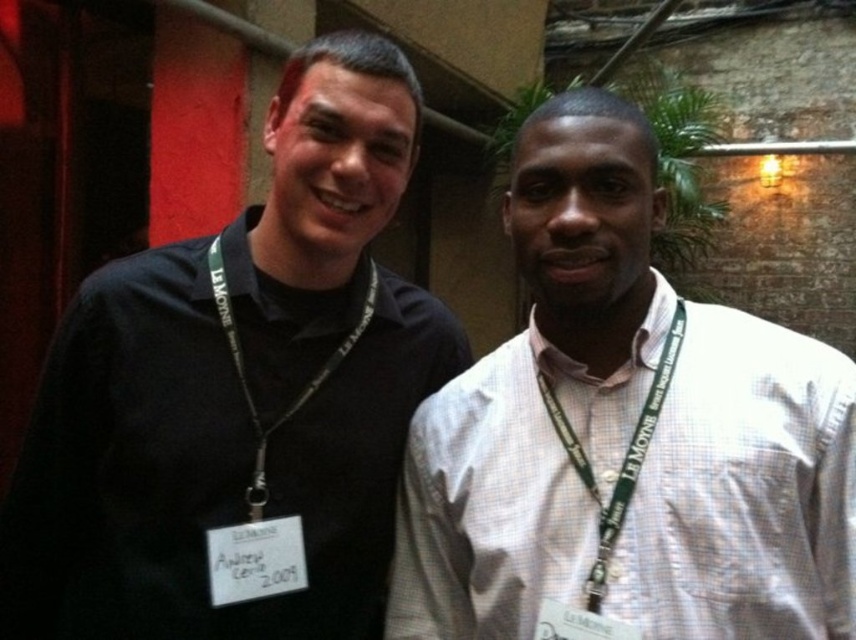
Can you confirm if white checkered shirt at right is thinner than black fabric lanyard at left?

In fact, white checkered shirt at right might be wider than black fabric lanyard at left.

Who is more distant from viewer, (421, 620) or (324, 374)?

Positioned behind is point (324, 374).

Find the location of `white checkered shirt at right`. white checkered shirt at right is located at coordinates (744, 492).

Which of these two, green fabric lanyard at center or black fabric lanyard at left, stands taller?

black fabric lanyard at left

Is point (663, 394) closer to camera compared to point (236, 358)?

Yes, point (663, 394) is in front of point (236, 358).

This screenshot has width=856, height=640. Identify the location of green fabric lanyard at center. (622, 460).

Identify the location of green fabric lanyard at center. (622, 460).

Which is behind, point (361, 148) or point (263, 452)?

Point (263, 452)

Who is more forward, (158, 378) or (226, 321)?

Positioned in front is point (158, 378).

Find the location of `black matte shirt at left`. black matte shirt at left is located at coordinates (239, 397).

At what (x,y) coordinates should I click in order to perform the action: click on black matte shirt at left. Please return your answer as a coordinate pair (x, y). This screenshot has width=856, height=640. Looking at the image, I should click on (239, 397).